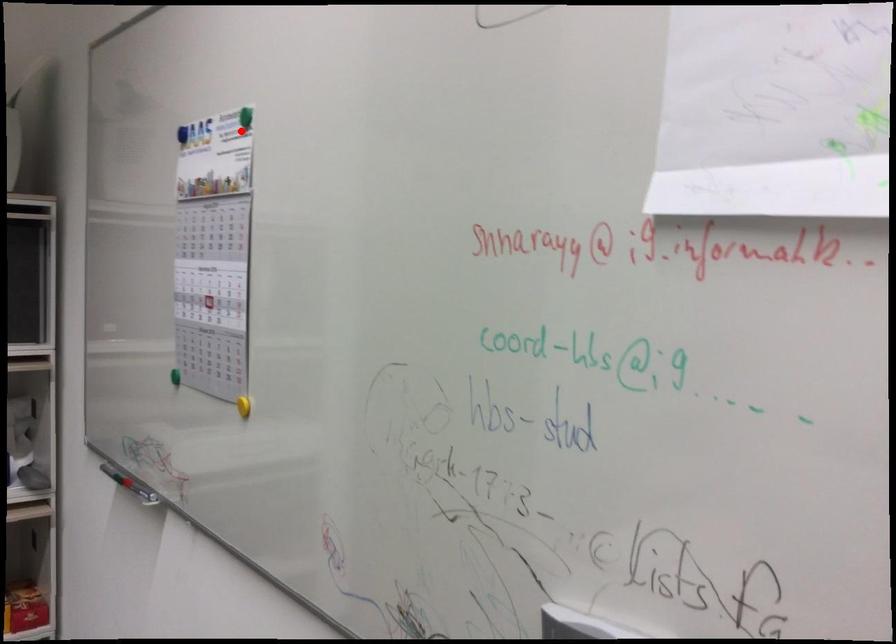
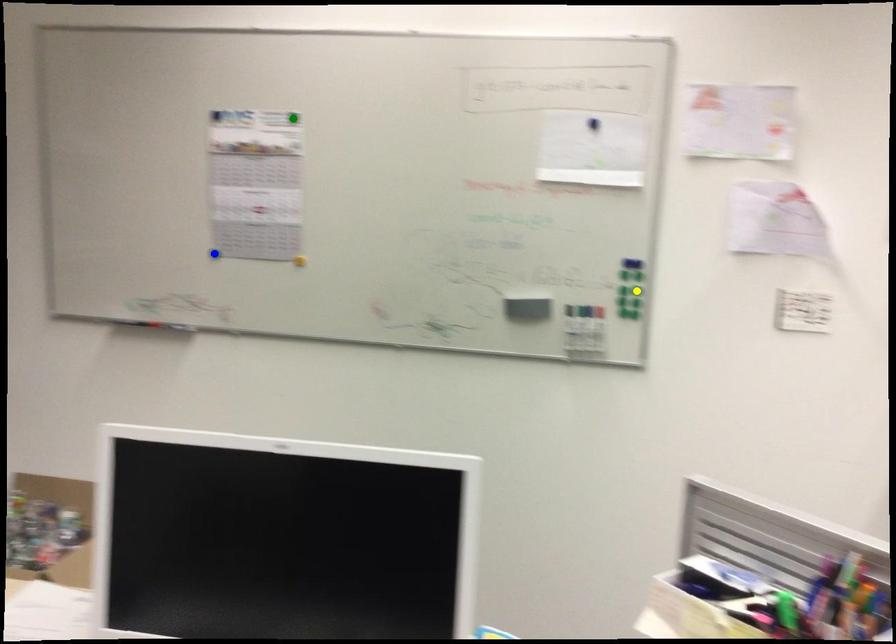
Question: I am providing you with two images of the same scene from different viewpoints. A red point is marked on the first image. You are given multiple points on the second image. In image 2, which mark is for the same physical point as the one in image 1?

Choices:
 (A) green point
 (B) yellow point
 (C) blue point

Answer: (A)